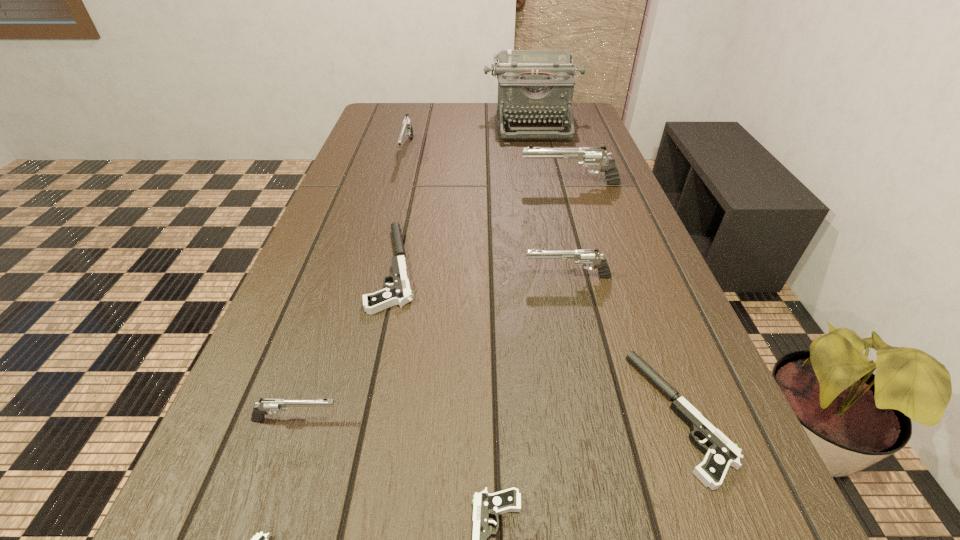
At what (x,y) coordinates should I click in order to perform the action: click on free location at the right edge. Please return your answer as a coordinate pair (x, y). Looking at the image, I should click on (593, 142).

Locate an element on the screen. This screenshot has height=540, width=960. vacant space at the far left corner of the desktop is located at coordinates (396, 120).

Identify the location of free area in between the fifth shortest object and the tallest object. The height and width of the screenshot is (540, 960). (415, 271).

In order to click on free space between the tallest object and the farthest pistol in this screenshot , I will do `click(470, 137)`.

Image resolution: width=960 pixels, height=540 pixels. I want to click on unoccupied position between the second tallest object and the nearest silver pistol, so click(433, 302).

The height and width of the screenshot is (540, 960). In order to click on free area in between the second tallest pistol and the biggest silver pistol in this screenshot , I will do `click(489, 168)`.

The height and width of the screenshot is (540, 960). Identify the location of vacant area that lies between the second smallest silver pistol and the second farthest silver pistol. pyautogui.click(x=569, y=231).

Where is `blank region between the farthest silver pistol and the tallest object`? The image size is (960, 540). blank region between the farthest silver pistol and the tallest object is located at coordinates (470, 137).

Select which object is the closest to the third shortest object. Please provide its 2D coordinates. Your answer should be formatted as a tuple, i.e. [(x, y)], where the tuple contains the x and y coordinates of a point satisfying the conditions above.

[(582, 257)]

Find the location of a particular element. The height and width of the screenshot is (540, 960). object that is the third closest to the tallest object is located at coordinates (399, 293).